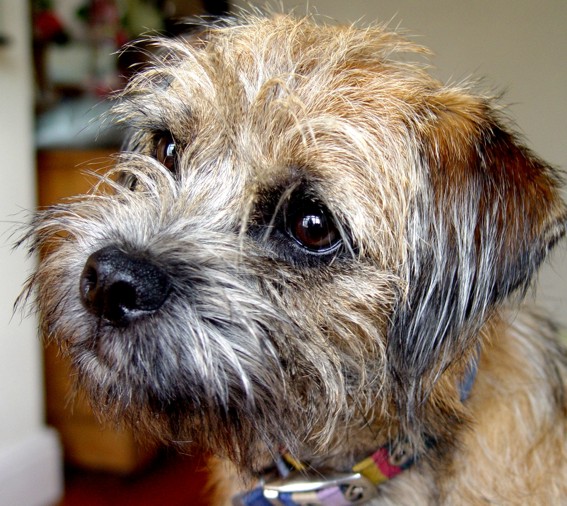
The height and width of the screenshot is (506, 567). I want to click on center wall behind dog head, so click(x=448, y=55).